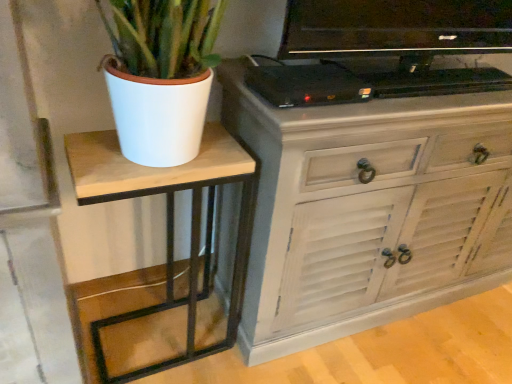
Question: Is black glossy television at upper center taller than distressed white cabinet at center?

Choices:
 (A) yes
 (B) no

Answer: (B)

Question: Is black glossy television at upper center shorter than distressed white cabinet at center?

Choices:
 (A) no
 (B) yes

Answer: (B)

Question: Is the depth of black glossy television at upper center greater than that of distressed white cabinet at center?

Choices:
 (A) no
 (B) yes

Answer: (A)

Question: From a real-world perspective, is black glossy television at upper center positioned over distressed white cabinet at center based on gravity?

Choices:
 (A) yes
 (B) no

Answer: (A)

Question: Considering the relative positions of black glossy television at upper center and distressed white cabinet at center in the image provided, is black glossy television at upper center in front of distressed white cabinet at center?

Choices:
 (A) yes
 (B) no

Answer: (A)

Question: Would you say black glossy television at upper center is outside distressed white cabinet at center?

Choices:
 (A) no
 (B) yes

Answer: (B)

Question: Considering the relative positions of black glossy television at upper center and wooden table at left in the image provided, is black glossy television at upper center to the left of wooden table at left from the viewer's perspective?

Choices:
 (A) no
 (B) yes

Answer: (A)

Question: Does black glossy television at upper center have a larger size compared to wooden table at left?

Choices:
 (A) no
 (B) yes

Answer: (A)

Question: Does black glossy television at upper center come in front of wooden table at left?

Choices:
 (A) no
 (B) yes

Answer: (B)

Question: Would you say black glossy television at upper center is outside wooden table at left?

Choices:
 (A) yes
 (B) no

Answer: (A)

Question: Are black glossy television at upper center and wooden table at left beside each other?

Choices:
 (A) yes
 (B) no

Answer: (B)

Question: From a real-world perspective, is black glossy television at upper center located beneath wooden table at left?

Choices:
 (A) yes
 (B) no

Answer: (B)

Question: Is black plastic device at upper center closer to the viewer compared to distressed white cabinet at center?

Choices:
 (A) yes
 (B) no

Answer: (B)